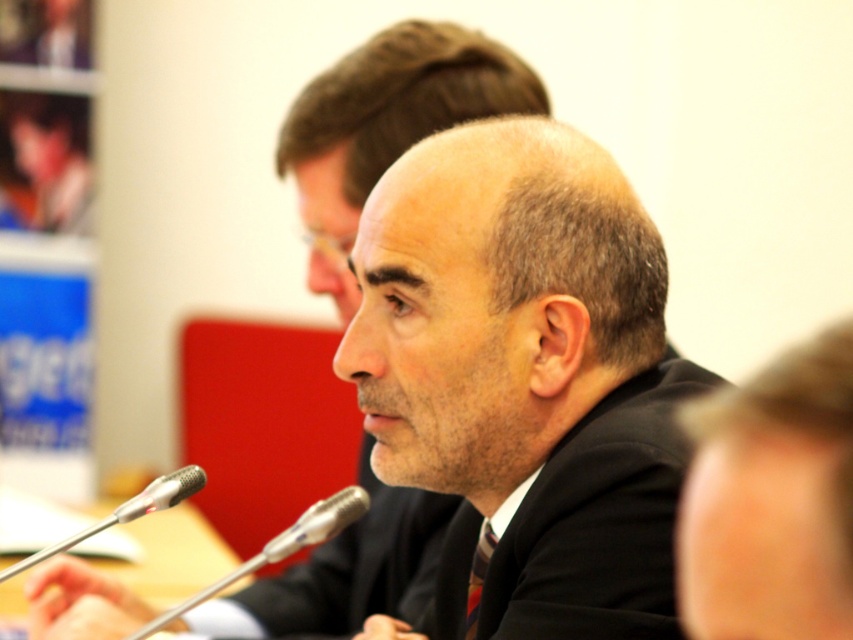
In the scene shown: Can you confirm if dark suit at center is positioned above silver metallic microphone at lower center?

Yes.

Does dark suit at center come behind silver metallic microphone at lower center?

No, it is in front of silver metallic microphone at lower center.

Is point (421, 298) positioned after point (316, 515)?

No, it is not.

Where is `dark suit at center`? This screenshot has height=640, width=853. dark suit at center is located at coordinates (527, 369).

Is point (596, 458) farther from camera compared to point (123, 627)?

No, it is not.

The height and width of the screenshot is (640, 853). What do you see at coordinates (527, 369) in the screenshot?
I see `dark suit at center` at bounding box center [527, 369].

What do you see at coordinates (527, 369) in the screenshot?
I see `dark suit at center` at bounding box center [527, 369].

The height and width of the screenshot is (640, 853). Identify the location of dark suit at center. (527, 369).

Who is shorter, smooth black suit at center or silver metallic microphone at lower center?

With less height is silver metallic microphone at lower center.

At what (x,y) coordinates should I click in order to perform the action: click on smooth black suit at center. Please return your answer as a coordinate pair (x, y). Looking at the image, I should click on (770, 500).